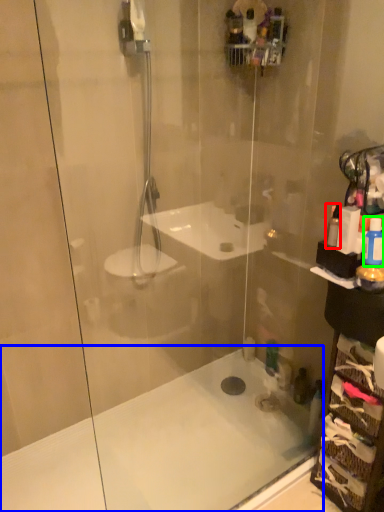
Question: Which object is the farthest from toiletry (highlighted by a red box)? Choose among these: bath (highlighted by a blue box) or toiletry (highlighted by a green box).

Choices:
 (A) bath
 (B) toiletry

Answer: (A)